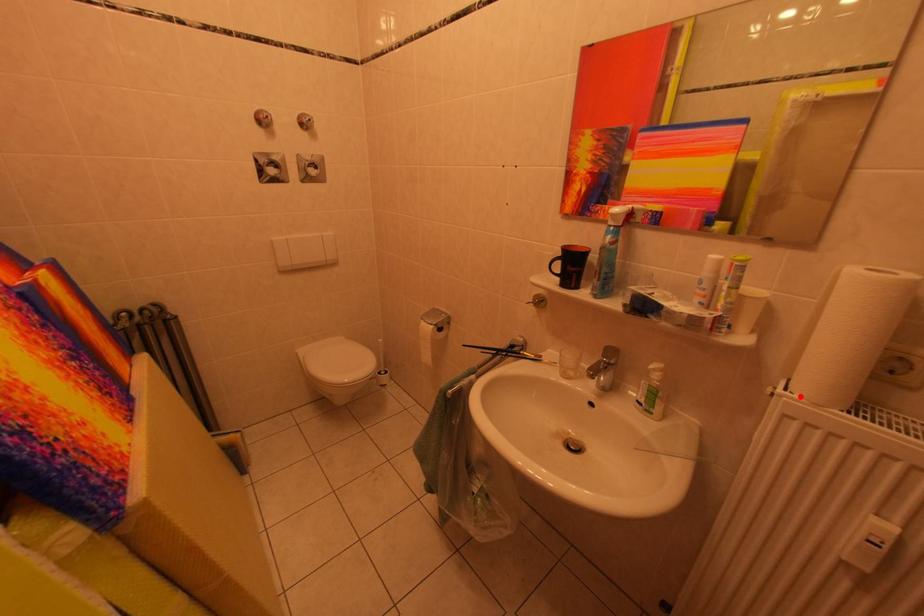
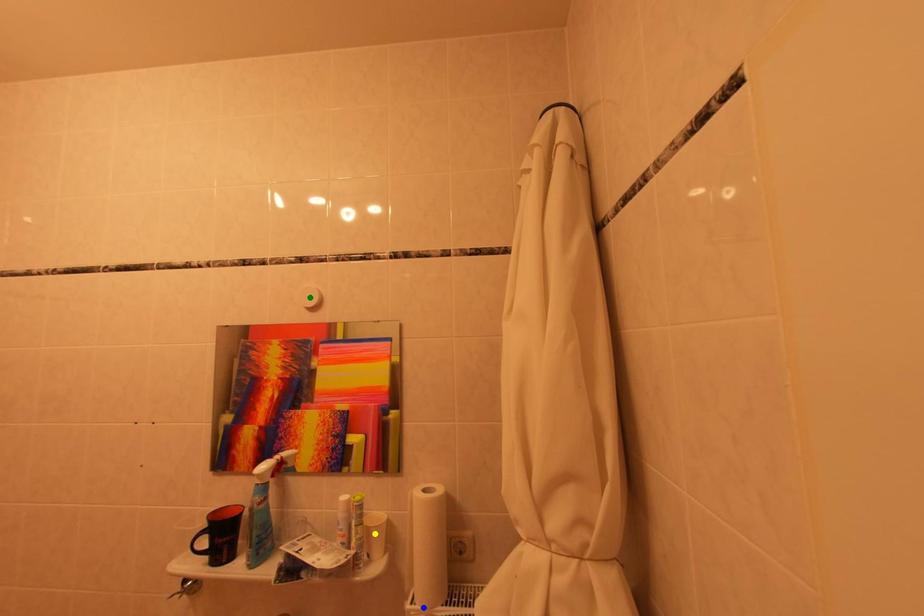
Question: I am providing you with two images of the same scene from different viewpoints. A red point is marked on the first image. You are given multiple points on the second image. Can you choose the point in image 2 that corresponds to the point in image 1?

Choices:
 (A) green point
 (B) yellow point
 (C) blue point

Answer: (C)